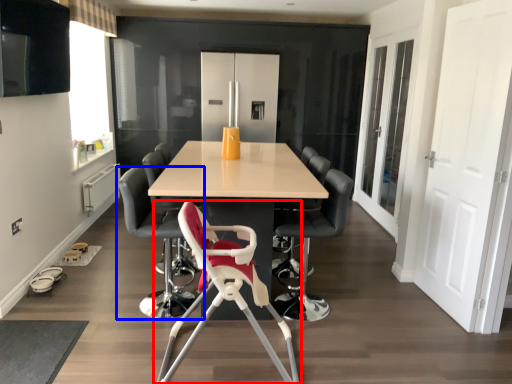
Question: Which of the following is the farthest to the observer, chair (highlighted by a red box) or chair (highlighted by a blue box)?

Choices:
 (A) chair
 (B) chair

Answer: (B)